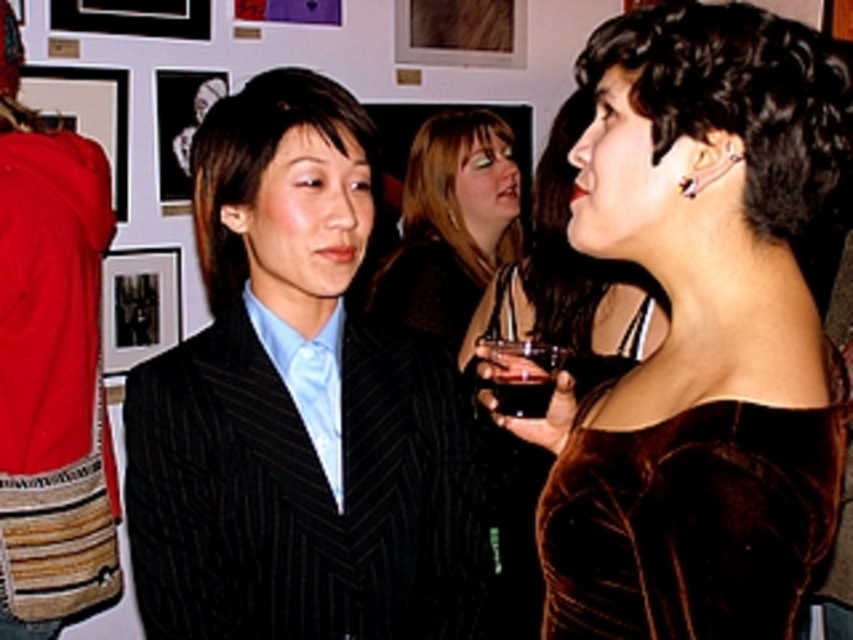
Question: Is brown velvet hair at upper right to the right of velvet brown dress at center from the viewer's perspective?

Choices:
 (A) no
 (B) yes

Answer: (B)

Question: Does velvet brown dress at right have a smaller size compared to velvet dress at center?

Choices:
 (A) yes
 (B) no

Answer: (A)

Question: Does velvet dress at center have a greater width compared to silver metallic earring at upper right?

Choices:
 (A) yes
 (B) no

Answer: (A)

Question: Which object is positioned closest to the velvet dress at center?

Choices:
 (A) brown velvet hair at upper right
 (B) dark liquid glass at center
 (C) matte black dress at center

Answer: (C)

Question: Estimate the real-world distances between objects in this image. Which object is farther from the brown velvet hair at upper right?

Choices:
 (A) velvet dress at center
 (B) matte black dress at center
 (C) silver metallic earring at upper right

Answer: (A)

Question: Which point appears farthest from the camera in this image?

Choices:
 (A) (697, 520)
 (B) (477, 148)
 (C) (770, 70)

Answer: (B)